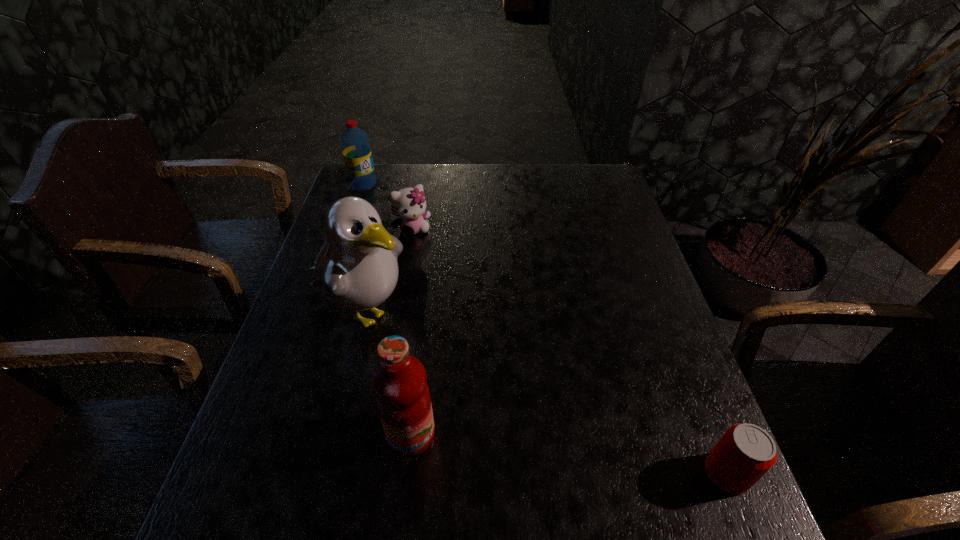
Identify the location of fruit juice that is at the near edge. This screenshot has width=960, height=540. (399, 381).

The height and width of the screenshot is (540, 960). I want to click on beer can that is at the near edge, so click(745, 452).

At what (x,y) coordinates should I click in order to perform the action: click on gull present at the left edge. Please return your answer as a coordinate pair (x, y). Looking at the image, I should click on (356, 269).

You are a GUI agent. You are given a task and a screenshot of the screen. Output one action in this format:
    pyautogui.click(x=<x>, y=<y>)
    Task: Click on the water bottle that is at the left edge
    The image size is (960, 540).
    Given the screenshot: What is the action you would take?
    pyautogui.click(x=355, y=144)

I want to click on object located in the right edge section of the desktop, so click(745, 452).

Where is `object situated at the far left corner`? The width and height of the screenshot is (960, 540). object situated at the far left corner is located at coordinates (355, 144).

Where is `object at the near right corner`? The image size is (960, 540). object at the near right corner is located at coordinates (745, 452).

The image size is (960, 540). Find the location of `vacant space at the far edge`. vacant space at the far edge is located at coordinates (430, 177).

At what (x,y) coordinates should I click in order to perform the action: click on blank space at the near edge of the desktop. Please return your answer as a coordinate pair (x, y). The image size is (960, 540). Looking at the image, I should click on (567, 453).

Locate an element on the screen. The image size is (960, 540). free space at the right edge of the desktop is located at coordinates (680, 382).